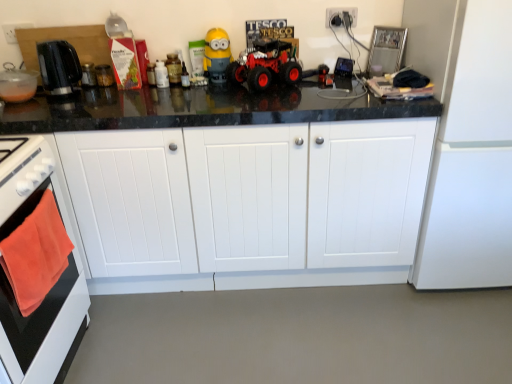
Question: Is there a large distance between orange towel at left and yellow matte minion at center?

Choices:
 (A) yes
 (B) no

Answer: (A)

Question: Does orange towel at left have a greater height compared to yellow matte minion at center?

Choices:
 (A) yes
 (B) no

Answer: (A)

Question: Is orange towel at left positioned with its back to yellow matte minion at center?

Choices:
 (A) no
 (B) yes

Answer: (A)

Question: Does orange towel at left come in front of yellow matte minion at center?

Choices:
 (A) no
 (B) yes

Answer: (B)

Question: Considering the relative sizes of orange towel at left and yellow matte minion at center in the image provided, is orange towel at left shorter than yellow matte minion at center?

Choices:
 (A) no
 (B) yes

Answer: (A)

Question: Does orange towel at left have a smaller size compared to yellow matte minion at center?

Choices:
 (A) yes
 (B) no

Answer: (B)

Question: Are metallic glass jar at upper left, positioned as the second appliance in left-to-right order, and yellow matte minion at center making contact?

Choices:
 (A) no
 (B) yes

Answer: (A)

Question: Is the depth of metallic glass jar at upper left, arranged as the second appliance when viewed from the right, greater than that of yellow matte minion at center?

Choices:
 (A) yes
 (B) no

Answer: (A)

Question: Considering the relative sizes of metallic glass jar at upper left, positioned as the second appliance in left-to-right order, and yellow matte minion at center in the image provided, is metallic glass jar at upper left, positioned as the second appliance in left-to-right order, bigger than yellow matte minion at center?

Choices:
 (A) yes
 (B) no

Answer: (B)

Question: From a real-world perspective, is metallic glass jar at upper left, positioned as the second appliance in left-to-right order, beneath yellow matte minion at center?

Choices:
 (A) yes
 (B) no

Answer: (A)

Question: Is metallic glass jar at upper left, positioned as the second appliance in left-to-right order, taller than yellow matte minion at center?

Choices:
 (A) yes
 (B) no

Answer: (B)

Question: From a real-world perspective, does metallic glass jar at upper left, positioned as the second appliance in left-to-right order, stand above yellow matte minion at center?

Choices:
 (A) no
 (B) yes

Answer: (A)

Question: Is white matte refrigerator at right positioned in front of black plastic kettle at left?

Choices:
 (A) yes
 (B) no

Answer: (A)